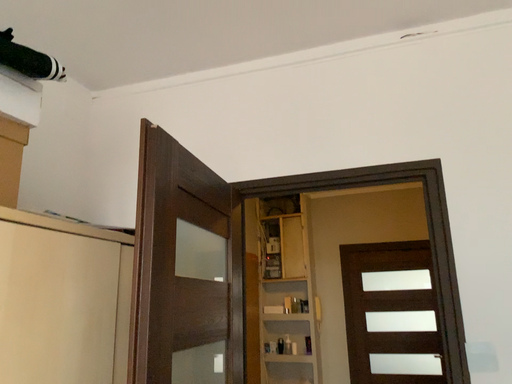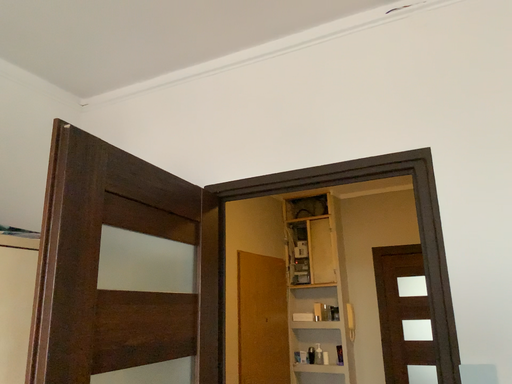
Question: How did the camera likely rotate when shooting the video?

Choices:
 (A) rotated left
 (B) rotated right

Answer: (A)